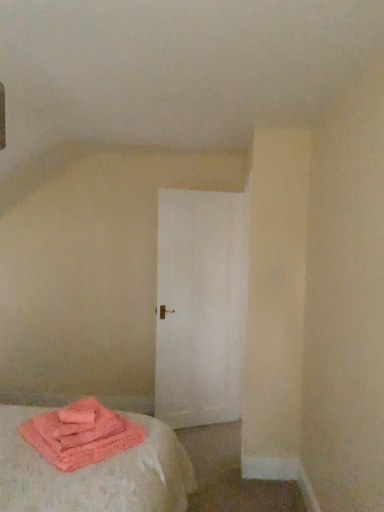
Question: Visually, is pink fluffy towels at lower left positioned to the left or to the right of white matte door at center?

Choices:
 (A) left
 (B) right

Answer: (A)

Question: From a real-world perspective, relative to white matte door at center, is pink fluffy towels at lower left vertically above or below?

Choices:
 (A) above
 (B) below

Answer: (B)

Question: Relative to white matte door at center, is pink fluffy towels at lower left in front or behind?

Choices:
 (A) front
 (B) behind

Answer: (A)

Question: Considering their positions, is white matte door at center located in front of or behind pink fluffy towels at lower left?

Choices:
 (A) front
 (B) behind

Answer: (B)

Question: In terms of size, does white matte door at center appear bigger or smaller than pink fluffy towels at lower left?

Choices:
 (A) big
 (B) small

Answer: (A)

Question: From a real-world perspective, relative to pink fluffy towels at lower left, is white matte door at center vertically above or below?

Choices:
 (A) above
 (B) below

Answer: (A)

Question: Would you say white matte door at center is inside or outside pink fluffy towels at lower left?

Choices:
 (A) outside
 (B) inside

Answer: (A)